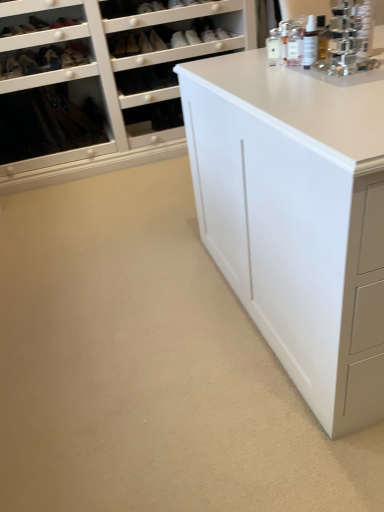
Question: Visually, is matte black shoe at upper left, the 3th shoe viewed from the right, positioned to the left or to the right of clear plastic spray bottle at upper right, which is the second toiletry in left-to-right order?

Choices:
 (A) right
 (B) left

Answer: (B)

Question: Is matte black shoe at upper left, the 1th shoe from the left, inside or outside of clear plastic spray bottle at upper right, which is the second toiletry in left-to-right order?

Choices:
 (A) outside
 (B) inside

Answer: (A)

Question: Estimate the real-world distances between objects in this image. Which object is farther from the matte black shoe at upper left, the 1th shoe from the left?

Choices:
 (A) matte black shoe at upper center, positioned as the third shoe in left-to-right order
 (B) clear plastic spray bottle at upper right, the second toiletry from the back
 (C) white glass bottle at upper right, the second toiletry viewed from the front
 (D) matte black shoe at upper left, the 2th shoe positioned from the left

Answer: (B)

Question: Estimate the real-world distances between objects in this image. Which object is closer to the matte black shoe at upper left, the 1th shoe from the left?

Choices:
 (A) white glass bottle at upper right, acting as the first toiletry starting from the back
 (B) matte black shoe at upper center, arranged as the 1th shoe when viewed from the right
 (C) clear plastic spray bottle at upper right, which is the second toiletry in left-to-right order
 (D) matte black shoe at upper left, the second shoe in the right-to-left sequence

Answer: (D)